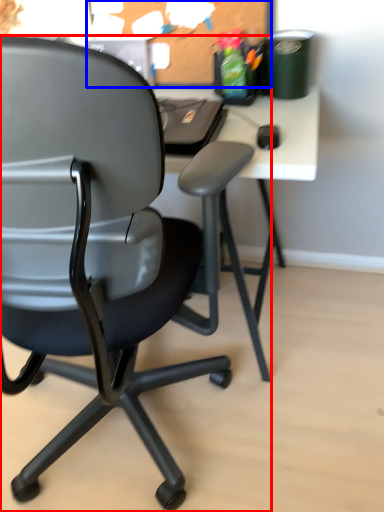
Question: Which of the following is the closest to the observer, chair (highlighted by a red box) or bulletin board (highlighted by a blue box)?

Choices:
 (A) chair
 (B) bulletin board

Answer: (A)